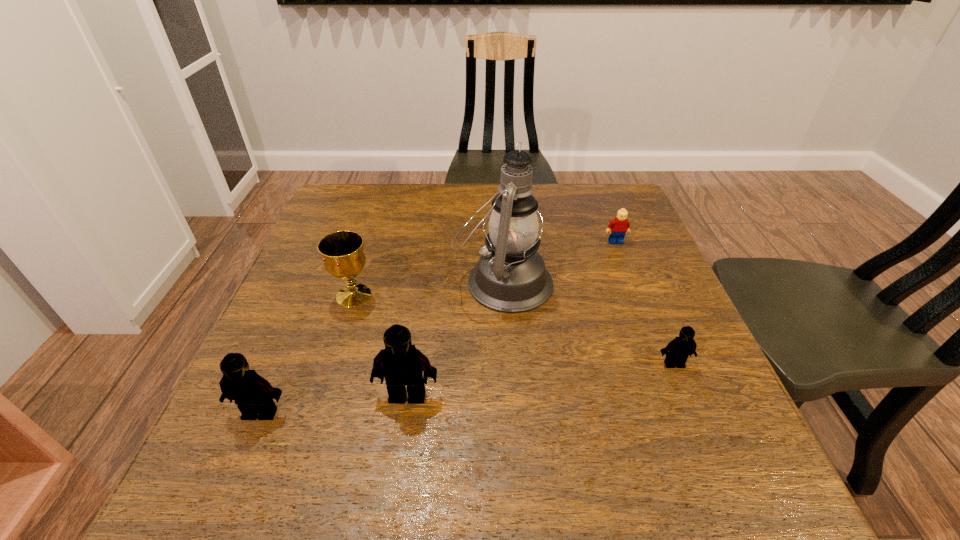
Locate an element on the screen. This screenshot has width=960, height=540. vacant space positioned 0.050m on the front of the chalice is located at coordinates (344, 328).

The width and height of the screenshot is (960, 540). I want to click on vacant space situated on the left of the third object from right to left, so click(x=385, y=282).

Identify the location of free spot located on the front-facing side of the farthest object. (652, 335).

At what (x,y) coordinates should I click in order to perform the action: click on Lego that is at the left edge. Please return your answer as a coordinate pair (x, y). This screenshot has height=540, width=960. Looking at the image, I should click on (253, 395).

Where is `chalice that is positioned at the left edge`? Image resolution: width=960 pixels, height=540 pixels. chalice that is positioned at the left edge is located at coordinates (342, 251).

This screenshot has width=960, height=540. What are the coordinates of `object located in the near left corner section of the desktop` in the screenshot? It's located at (253, 395).

In the image, there is a desktop. Where is `free space at the far edge`? free space at the far edge is located at coordinates (553, 221).

The width and height of the screenshot is (960, 540). Identify the location of blank space at the left edge of the desktop. (328, 313).

You are a GUI agent. You are given a task and a screenshot of the screen. Output one action in this format:
    pyautogui.click(x=<x>, y=<y>)
    Task: Click on the vacant space at the right edge
    The width and height of the screenshot is (960, 540).
    Given the screenshot: What is the action you would take?
    pyautogui.click(x=610, y=253)

Identify the location of vacant space at the far left corner of the desktop. click(365, 192).